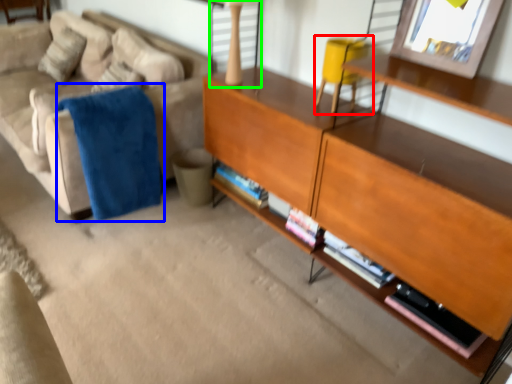
Question: Which object is the farthest from swivel chair (highlighted by a red box)? Choose among these: blanket (highlighted by a blue box) or table lamp (highlighted by a green box).

Choices:
 (A) blanket
 (B) table lamp

Answer: (A)